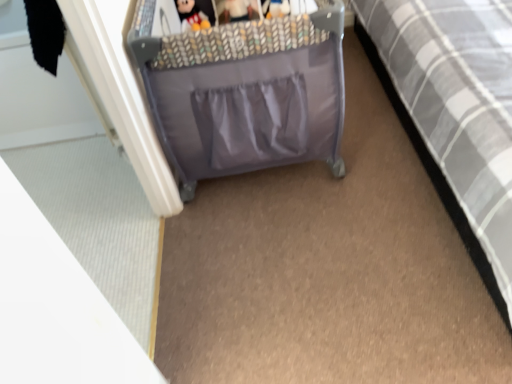
Question: Would you say gray fabric bed at right is inside or outside plush fabric plushie at upper center?

Choices:
 (A) inside
 (B) outside

Answer: (B)

Question: Is point (493, 3) closer or farther from the camera than point (187, 18)?

Choices:
 (A) closer
 (B) farther

Answer: (B)

Question: Considering the positions of gray fabric bed at right and plush fabric plushie at upper center in the image, is gray fabric bed at right taller or shorter than plush fabric plushie at upper center?

Choices:
 (A) short
 (B) tall

Answer: (B)

Question: Considering the positions of plush fabric plushie at upper center and gray fabric bed at right in the image, is plush fabric plushie at upper center taller or shorter than gray fabric bed at right?

Choices:
 (A) short
 (B) tall

Answer: (A)

Question: Based on their positions, is plush fabric plushie at upper center located to the left or right of gray fabric bed at right?

Choices:
 (A) left
 (B) right

Answer: (A)

Question: Relative to gray fabric bed at right, is plush fabric plushie at upper center in front or behind?

Choices:
 (A) front
 (B) behind

Answer: (B)

Question: Looking at their shapes, would you say plush fabric plushie at upper center is wider or thinner than gray fabric bed at right?

Choices:
 (A) thin
 (B) wide

Answer: (A)